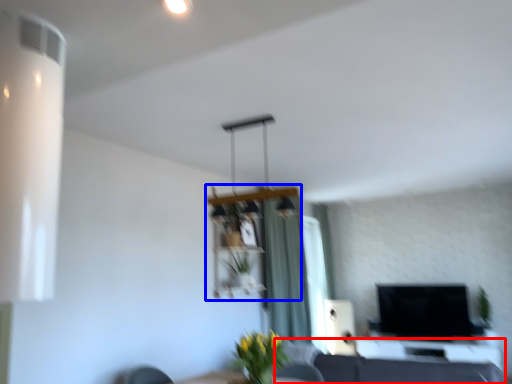
Question: Which object is further to the camera taking this photo, couch (highlighted by a red box) or shelf (highlighted by a blue box)?

Choices:
 (A) couch
 (B) shelf

Answer: (B)